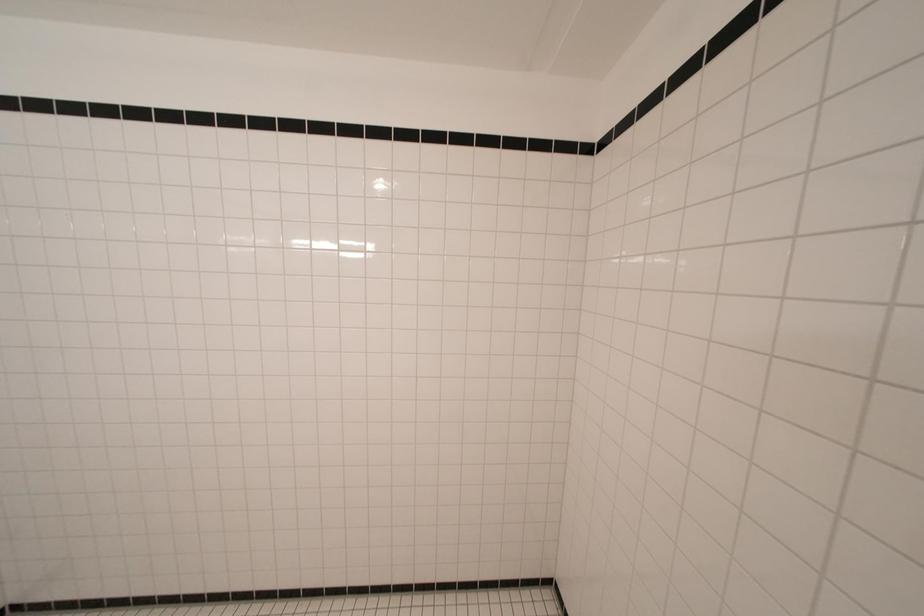
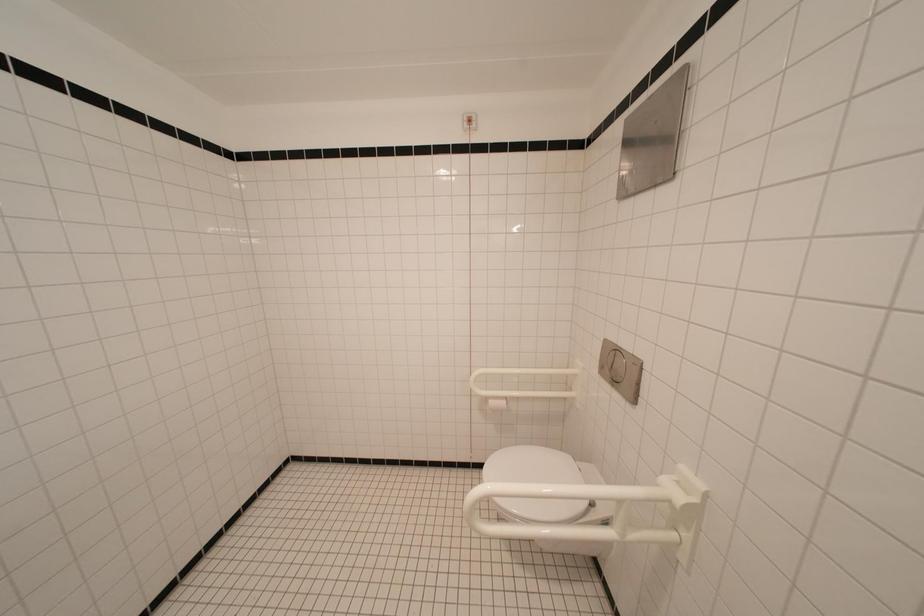
Question: The images are taken continuously from a first-person perspective. In which direction is your viewpoint rotating?

Choices:
 (A) Left
 (B) Right
 (C) Up
 (D) Down

Answer: (B)